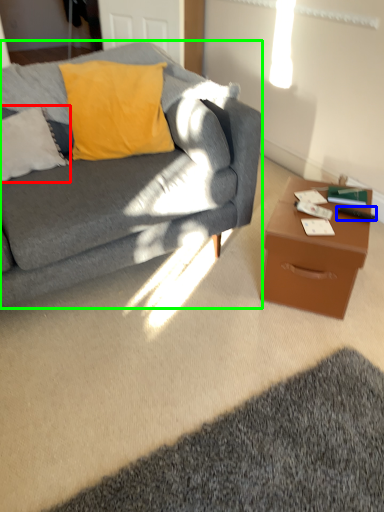
Question: Based on their relative distances, which object is nearer to pillow (highlighted by a red box)? Choose from remote control (highlighted by a blue box) and studio couch (highlighted by a green box).

Choices:
 (A) remote control
 (B) studio couch

Answer: (B)